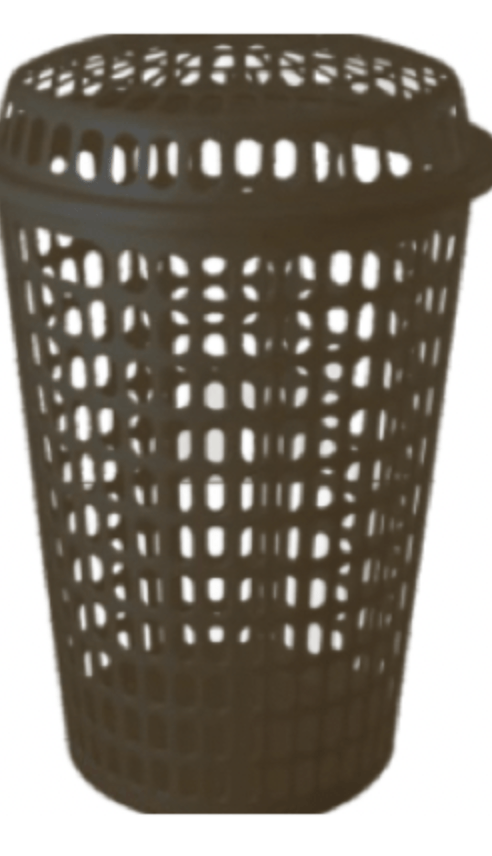
Where is `black lid for basket with holes`? The width and height of the screenshot is (492, 856). black lid for basket with holes is located at coordinates (247, 119).